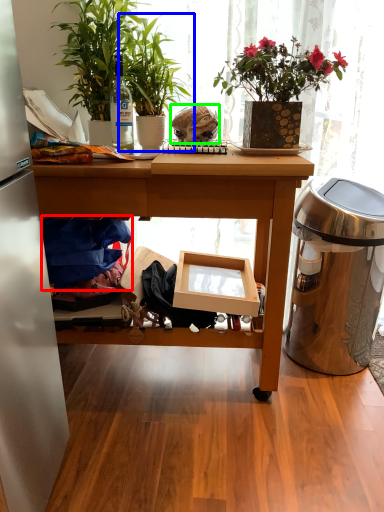
Question: Estimate the real-world distances between objects in this image. Which object is closer to clothing (highlighted by a red box), houseplant (highlighted by a blue box) or food (highlighted by a green box)?

Choices:
 (A) houseplant
 (B) food

Answer: (A)